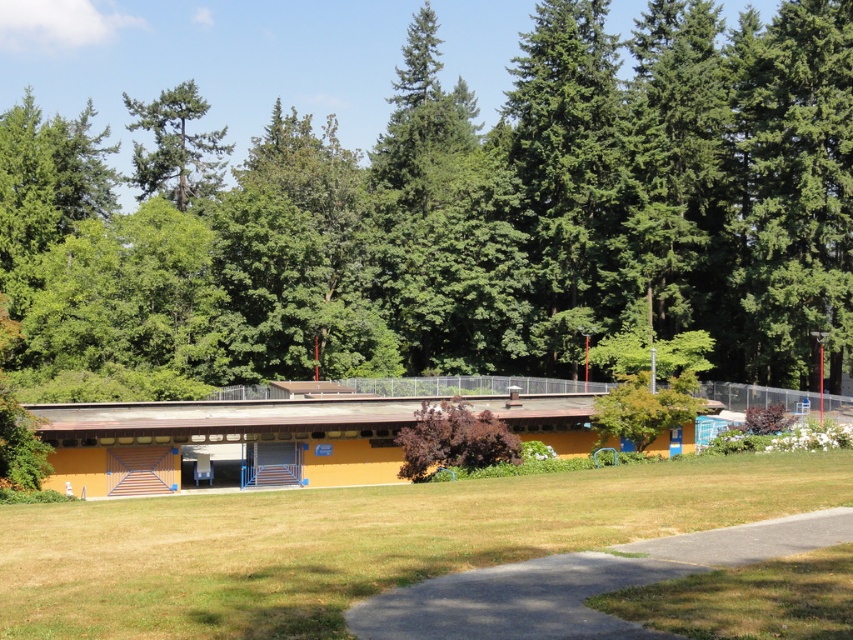
Is green grass at center further to the viewer compared to green matte tree at upper center?

No, green grass at center is in front of green matte tree at upper center.

Does green grass at center appear on the left side of green matte tree at upper center?

In fact, green grass at center is to the right of green matte tree at upper center.

Who is more forward, (x=525, y=531) or (x=128, y=128)?

Point (x=525, y=531) is in front.

Find the location of a particular element. Image resolution: width=853 pixels, height=640 pixels. green grass at center is located at coordinates (355, 541).